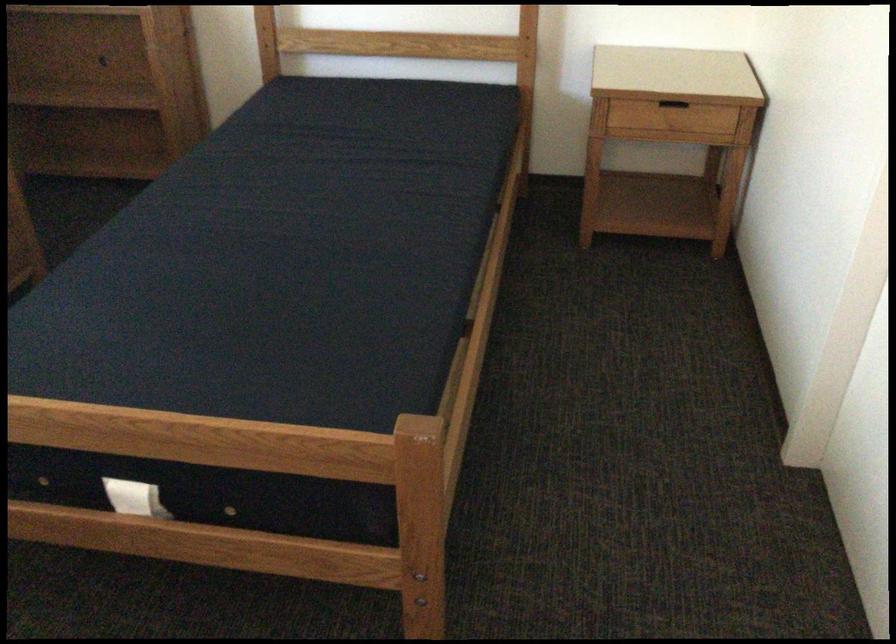
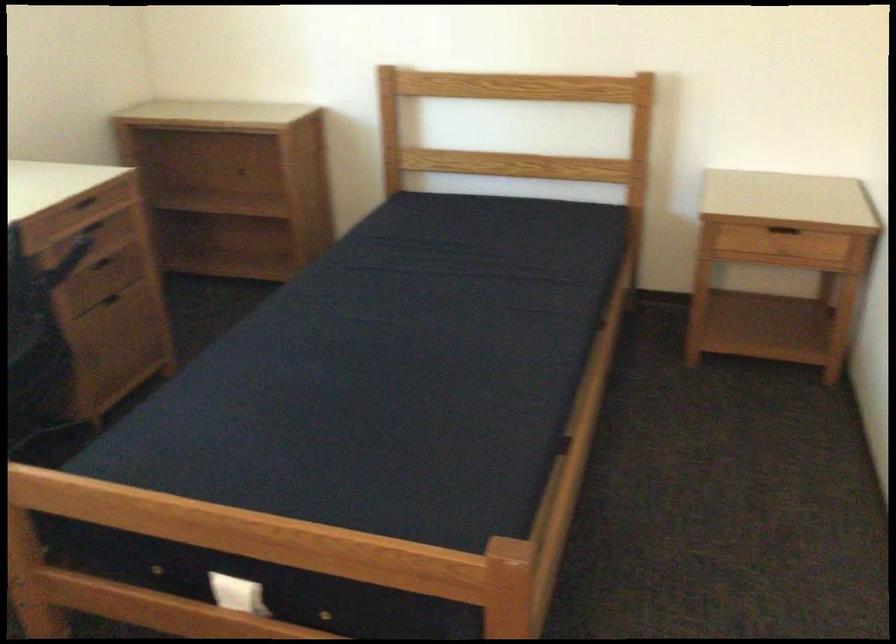
Question: In a continuous first-person perspective shot, in which direction is the camera moving?

Choices:
 (A) Left
 (B) Right
 (C) Forward
 (D) Backward

Answer: (D)